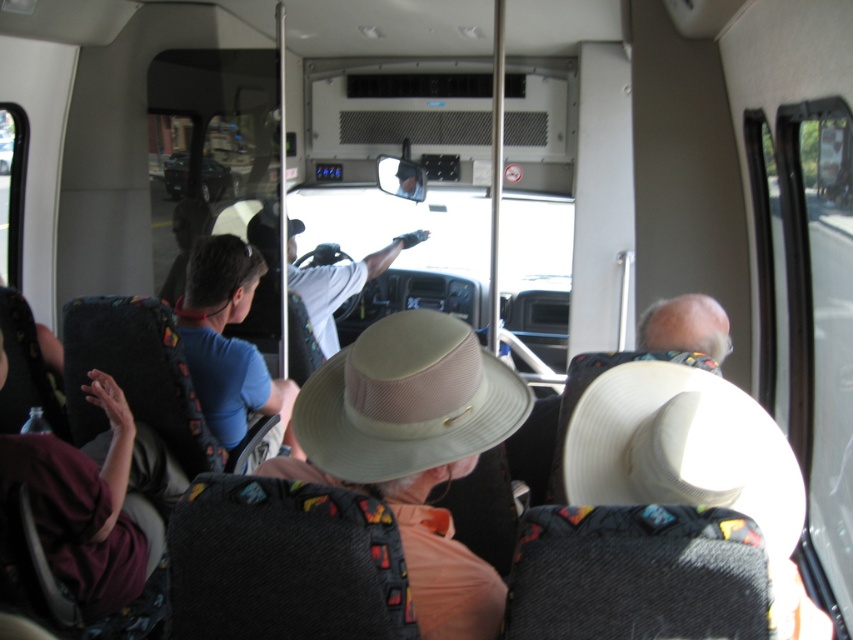
Is tan mesh cowboy hat at center below white fabric shirt at center?

Yes.

Between tan mesh cowboy hat at center and white fabric shirt at center, which one appears on the right side from the viewer's perspective?

tan mesh cowboy hat at center

The height and width of the screenshot is (640, 853). What are the coordinates of `tan mesh cowboy hat at center` in the screenshot? It's located at (407, 401).

Which is in front, point (581, 408) or point (231, 385)?

Point (581, 408)

Between white woven cowboy hat at center and blue cotton shirt at center, which one is positioned lower?

white woven cowboy hat at center is below.

Is point (761, 467) in front of point (199, 337)?

Yes, point (761, 467) is closer to viewer.

Where is `white woven cowboy hat at center`? white woven cowboy hat at center is located at coordinates (682, 449).

Who is lower down, blue cotton shirt at center or gray fabric hat at upper center?

Positioned lower is blue cotton shirt at center.

Does blue cotton shirt at center appear on the left side of gray fabric hat at upper center?

Correct, you'll find blue cotton shirt at center to the left of gray fabric hat at upper center.

Who is more distant from viewer, (229, 321) or (645, 337)?

The point (229, 321) is behind.

At what (x,y) coordinates should I click in order to perform the action: click on blue cotton shirt at center. Please return your answer as a coordinate pair (x, y). Image resolution: width=853 pixels, height=640 pixels. Looking at the image, I should click on (229, 344).